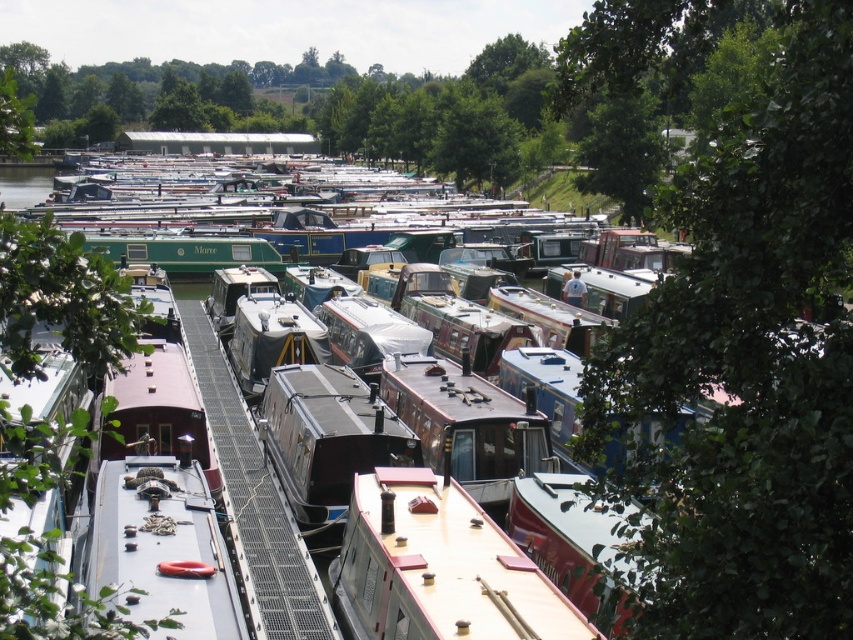
Question: Considering the relative positions of rustic wood boat at center and green leafy tree at upper center in the image provided, where is rustic wood boat at center located with respect to green leafy tree at upper center?

Choices:
 (A) right
 (B) left

Answer: (B)

Question: Among these points, which one is nearest to the camera?

Choices:
 (A) (440, 381)
 (B) (67, 154)

Answer: (A)

Question: Among these points, which one is nearest to the camera?

Choices:
 (A) (312, 422)
 (B) (357, 596)
 (C) (224, 314)

Answer: (B)

Question: Among these points, which one is farthest from the camera?

Choices:
 (A) (163, 545)
 (B) (416, 280)
 (C) (459, 115)
 (D) (409, 458)

Answer: (C)

Question: Does metallic silver barge at center have a larger size compared to green leafy tree at upper left?

Choices:
 (A) no
 (B) yes

Answer: (A)

Question: Can you confirm if white matte boat at center is thinner than rustic wood boat at center?

Choices:
 (A) yes
 (B) no

Answer: (B)